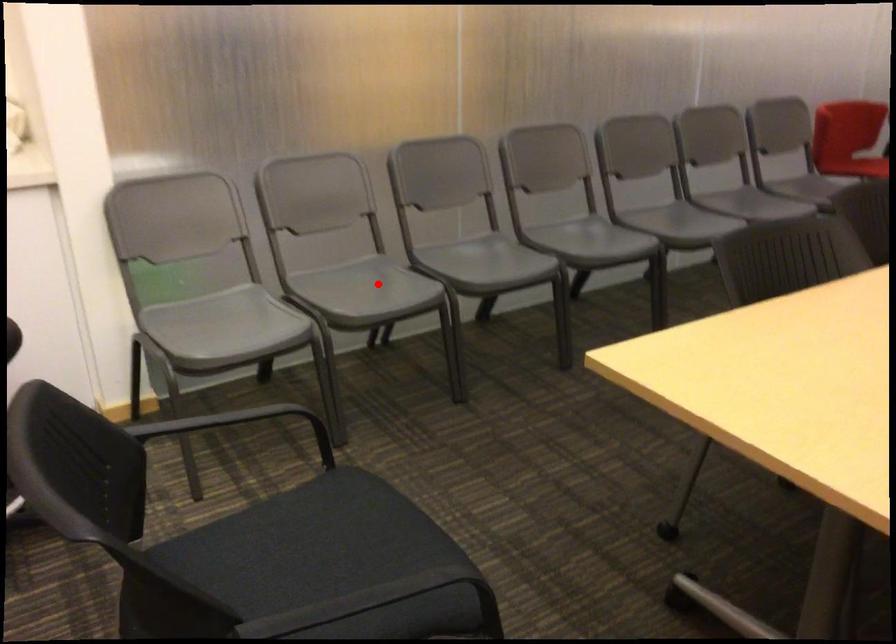
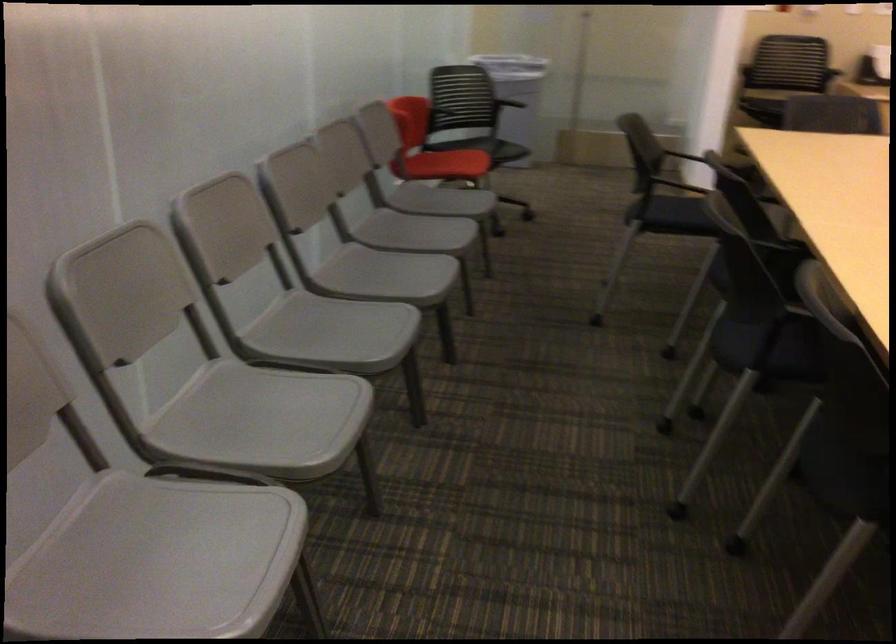
Question: A red point is marked in image1. In image2, is the corresponding 3D point closer to the camera or farther? Reply with the corresponding letter.

Choices:
 (A) The corresponding 3D point is closer.
 (B) The corresponding 3D point is farther.

Answer: (A)